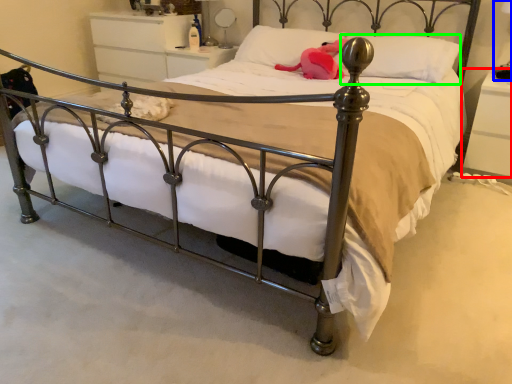
Question: Estimate the real-world distances between objects in this image. Which object is closer to nightstand (highlighted by a red box), table lamp (highlighted by a blue box) or pillow (highlighted by a green box)?

Choices:
 (A) table lamp
 (B) pillow

Answer: (A)